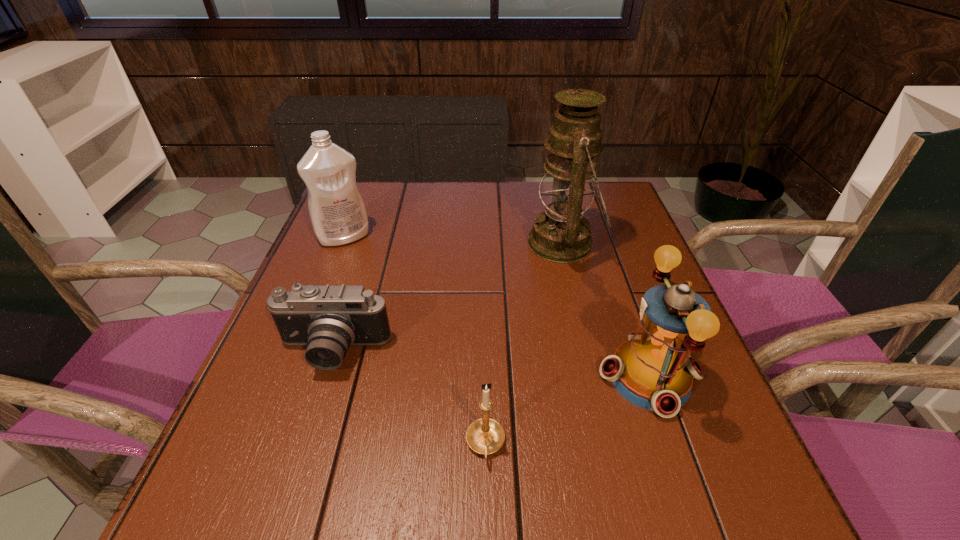
In the image, there is a desktop. At what (x,y) coordinates should I click in order to perform the action: click on vacant region at the far edge. Please return your answer as a coordinate pair (x, y). This screenshot has height=540, width=960. Looking at the image, I should click on (515, 219).

Identify the location of vacant space at the near edge of the desktop. pyautogui.click(x=546, y=524).

Where is `vacant area at the left edge of the desktop`? Image resolution: width=960 pixels, height=540 pixels. vacant area at the left edge of the desktop is located at coordinates (277, 377).

This screenshot has height=540, width=960. Find the location of `free region at the far left corner of the desktop`. free region at the far left corner of the desktop is located at coordinates (374, 212).

In the image, there is a desktop. Identify the location of vacant region at the near right corner. (705, 535).

Where is `blank region between the detergent and the lantern`? The height and width of the screenshot is (540, 960). blank region between the detergent and the lantern is located at coordinates (496, 306).

The width and height of the screenshot is (960, 540). What are the coordinates of `vacant region between the tallest object and the third shortest object` in the screenshot? It's located at (607, 310).

Where is `vacant area that lies between the tallest object and the detergent`? vacant area that lies between the tallest object and the detergent is located at coordinates (454, 240).

Where is `unoccupied position between the camera and the candle holder`? The image size is (960, 540). unoccupied position between the camera and the candle holder is located at coordinates (409, 399).

This screenshot has height=540, width=960. What are the coordinates of `free space that is in between the detergent and the candle holder` in the screenshot? It's located at (415, 341).